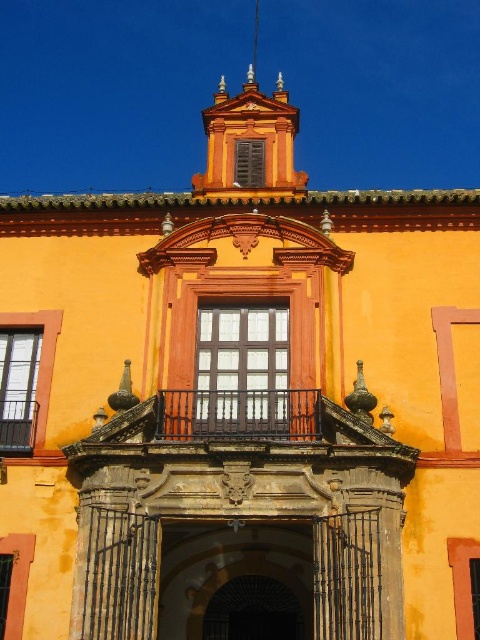
Between black wrought iron balcony at center and black wrought iron balcony at upper center, which one appears on the left side from the viewer's perspective?

Positioned to the left is black wrought iron balcony at upper center.

Is black wrought iron balcony at center behind black wrought iron balcony at upper center?

No.

What are the coordinates of `black wrought iron balcony at center` in the screenshot? It's located at (239, 436).

This screenshot has width=480, height=640. What are the coordinates of `golden ornate gate at center` in the screenshot? It's located at (236, 580).

Who is more distant from viewer, (162, 584) or (142, 428)?

Point (162, 584)

Identify the location of golden ornate gate at center. (236, 580).

Looking at this image, between dark brick archway at center and black wrought iron balcony at upper center, which one is positioned lower?

dark brick archway at center

Does dark brick archway at center appear over black wrought iron balcony at upper center?

No.

Is point (272, 600) closer to viewer compared to point (33, 440)?

No, it is not.

The height and width of the screenshot is (640, 480). I want to click on dark brick archway at center, so click(252, 611).